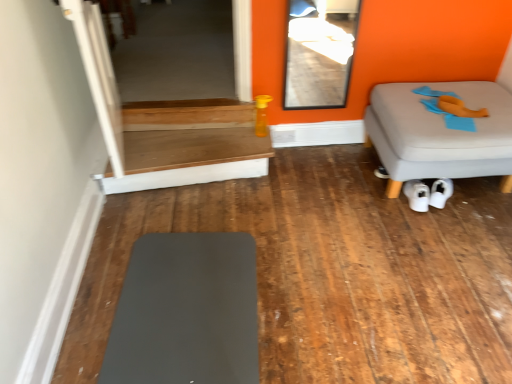
Where is `free area in between gray fabric ottoman at right, the first furniture in the top-to-bottom sequence, and white matte sneakers at lower center`? The height and width of the screenshot is (384, 512). free area in between gray fabric ottoman at right, the first furniture in the top-to-bottom sequence, and white matte sneakers at lower center is located at coordinates (459, 211).